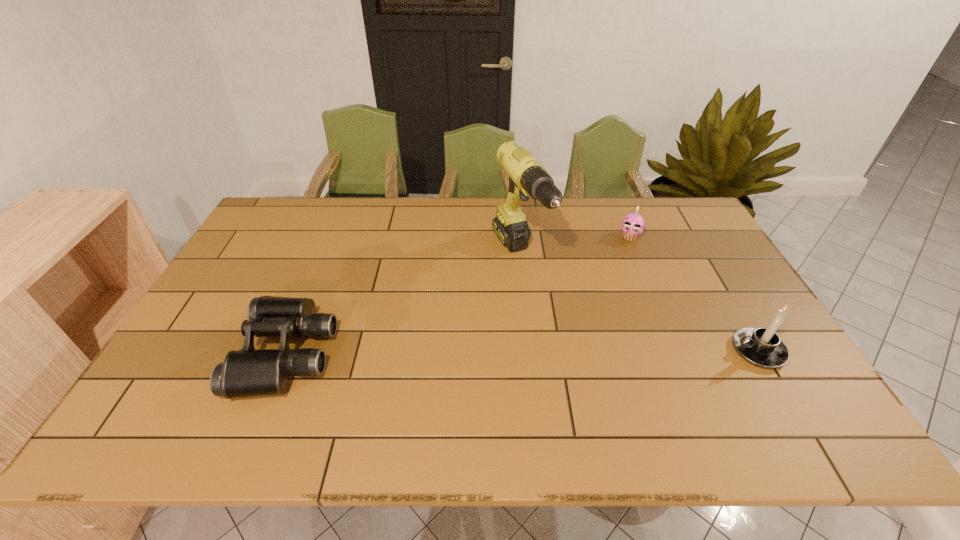
At what (x,y) coordinates should I click in order to perform the action: click on binoculars positioned at the near edge. Please return your answer as a coordinate pair (x, y). Image resolution: width=960 pixels, height=540 pixels. Looking at the image, I should click on (248, 372).

The image size is (960, 540). I want to click on candle holder that is at the near edge, so click(762, 347).

Identify the location of object that is at the right edge. Image resolution: width=960 pixels, height=540 pixels. (762, 347).

Locate an element on the screen. The image size is (960, 540). object at the near right corner is located at coordinates (762, 347).

I want to click on free space at the far edge, so click(x=458, y=227).

This screenshot has height=540, width=960. In order to click on free space at the near edge of the desktop in this screenshot , I will do `click(432, 368)`.

Identify the location of vacant space at the left edge of the desktop. The width and height of the screenshot is (960, 540). (286, 246).

The height and width of the screenshot is (540, 960). Identify the location of vacant region at the right edge of the desktop. (732, 303).

Locate an element on the screen. The width and height of the screenshot is (960, 540). vacant space at the far left corner is located at coordinates (294, 220).

Find the location of a particular element. Image resolution: width=960 pixels, height=540 pixels. vacant area at the far right corner of the desktop is located at coordinates (708, 233).